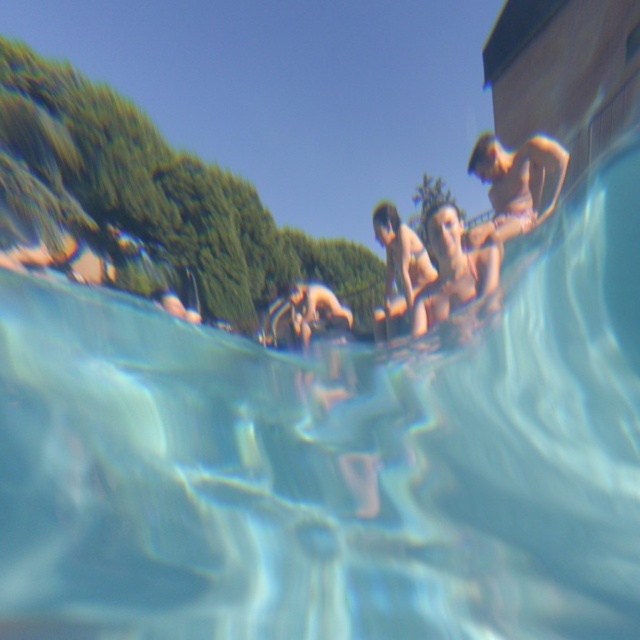
You are an underwater photographer aiming to capture a shot of the matte bikini swimmer at center without including the tan skin man at upper right in the frame. Based on their positions, can you position yourself to take the photo without the man blocking the view?

The tan skin man at upper right is above the matte bikini swimmer at center, so positioning yourself directly below the swimmer or moving to the side might allow you to capture the swimmer without the man blocking the view.

You are an underwater photographer aiming to capture a photo of the tan skin man at upper right and the matte bikini swimmer at center. Which subject should you focus on first to ensure clarity in your shot?

The tan skin man at upper right is closer to the viewer than the matte bikini swimmer at center, so you should focus on the tan skin man at upper right first to ensure clarity in your shot.

You are a swimmer trying to locate the tan skin man at upper right and the matte bikini swimmer at center from underwater. Which of the two appears bigger to you?

The tan skin man at upper right appears larger than the matte bikini swimmer at center because he is closer to the surface above you.